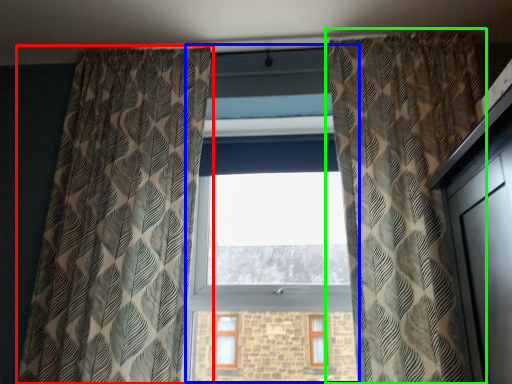
Question: Which is farther away from curtain (highlighted by a red box)? bay window (highlighted by a blue box) or curtain (highlighted by a green box)?

Choices:
 (A) bay window
 (B) curtain

Answer: (B)